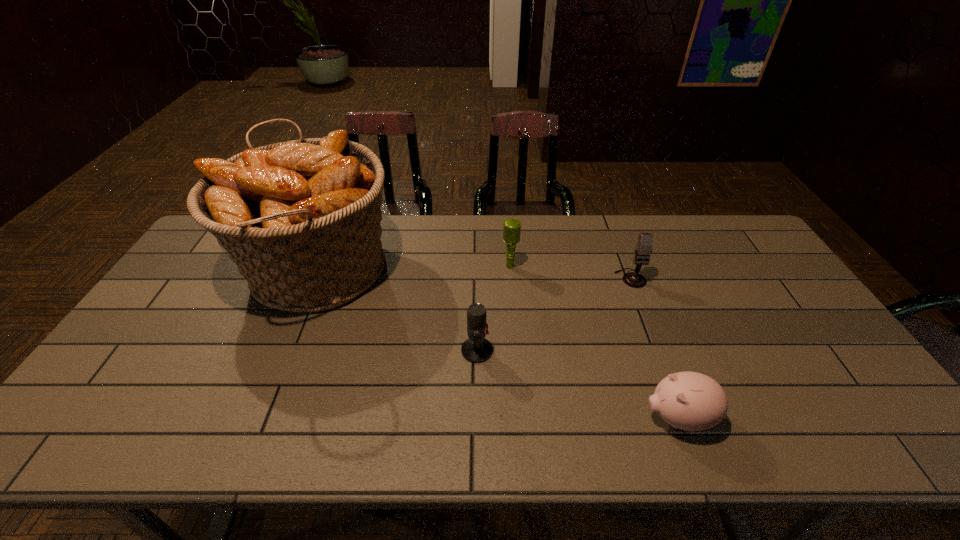
Identify the location of vacant space situated 0.310m on the front-facing side of the rightmost microphone. This screenshot has width=960, height=540. (666, 373).

Where is `vacant position located 0.170m on the side of the fourth farthest object with the red ring`? Image resolution: width=960 pixels, height=540 pixels. vacant position located 0.170m on the side of the fourth farthest object with the red ring is located at coordinates (557, 350).

Locate an element on the screen. Image resolution: width=960 pixels, height=540 pixels. vacant space located at the snout of the piggy bank is located at coordinates (547, 418).

You are a GUI agent. You are given a task and a screenshot of the screen. Output one action in this format:
    pyautogui.click(x=<x>, y=<y>)
    Task: Click on the free region located 0.350m at the snout of the piggy bank
    This screenshot has height=540, width=960.
    Given the screenshot: What is the action you would take?
    pyautogui.click(x=492, y=418)

Identify the location of free space located at the snout of the piggy bank. Image resolution: width=960 pixels, height=540 pixels. (500, 418).

This screenshot has height=540, width=960. I want to click on object situated at the far edge, so click(x=301, y=219).

Locate an element on the screen. object at the near edge is located at coordinates (691, 401).

Where is `free space at the far edge`? The width and height of the screenshot is (960, 540). free space at the far edge is located at coordinates (439, 255).

Locate an element on the screen. The width and height of the screenshot is (960, 540). vacant area at the near edge is located at coordinates (427, 435).

The height and width of the screenshot is (540, 960). In the image, there is a desktop. What are the coordinates of `free space at the left edge` in the screenshot? It's located at (206, 310).